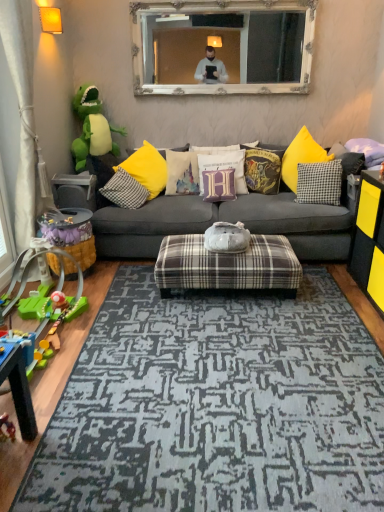
Question: Does point (279, 37) appear closer or farther from the camera than point (221, 155)?

Choices:
 (A) closer
 (B) farther

Answer: (B)

Question: Choose the correct answer: Is white ornate mirror at upper center inside purple fabric pillow at center, the 4th pillow from the left, or outside it?

Choices:
 (A) outside
 (B) inside

Answer: (A)

Question: Based on their relative distances, which object is farther from the white cotton cushion at center, marked as the 2th pillow in a left-to-right arrangement?

Choices:
 (A) purple fabric pillow at upper right, which ranks as the seventh pillow in left-to-right order
 (B) velvet harry potter-themed pillow at center, which appears as the third pillow when viewed from the right
 (C) plaid fabric couch at center
 (D) black matte dresser at right
 (E) purple velvet pillow at center, which is counted as the third pillow, starting from the left

Answer: (D)

Question: Which object is the farthest from the white cotton cushion at center, marked as the 2th pillow in a left-to-right arrangement?

Choices:
 (A) plastic green toy at left, which is counted as the third toy, starting from the back
 (B) velvet harry potter-themed pillow at center, which is counted as the fifth pillow, starting from the left
 (C) plaid fabric ottoman at center, positioned as the first table in right-to-left order
 (D) plastic yellow and blue train at lower left, marked as the first toy in a front-to-back arrangement
 (E) plastic yellow toy at left, which ranks as the second toy in back-to-front order

Answer: (D)